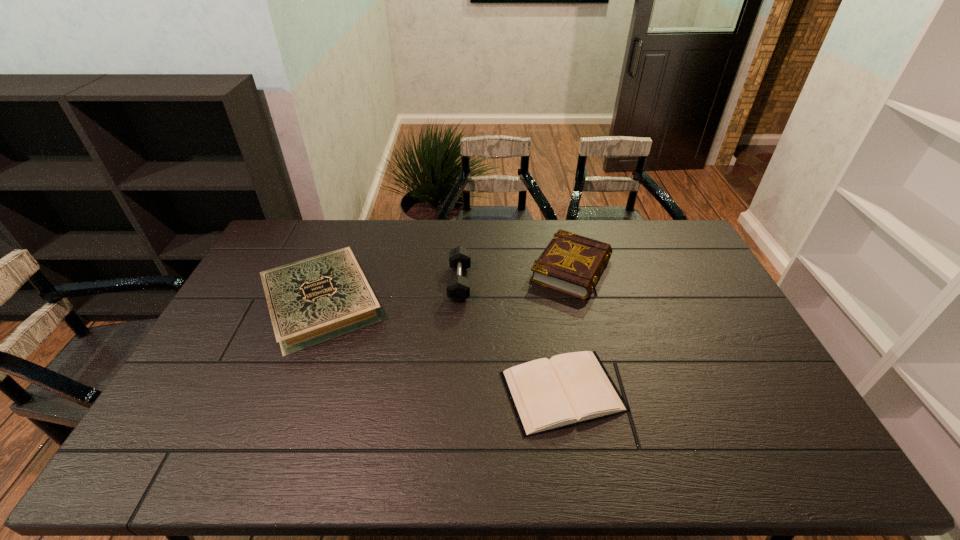
Find the location of `dumbbell`. dumbbell is located at coordinates pyautogui.click(x=458, y=287).

The width and height of the screenshot is (960, 540). I want to click on the third object from right to left, so click(458, 287).

The height and width of the screenshot is (540, 960). I want to click on the leftmost hardback book, so click(310, 301).

You are a GUI agent. You are given a task and a screenshot of the screen. Output one action in this format:
    pyautogui.click(x=<x>, y=<y>)
    Task: Click on the shortest hardback book
    Image resolution: width=960 pixels, height=540 pixels.
    Given the screenshot: What is the action you would take?
    pyautogui.click(x=546, y=394)

Where is `free location located on the left of the dumbbell`? free location located on the left of the dumbbell is located at coordinates click(391, 282).

The height and width of the screenshot is (540, 960). I want to click on blank space located 0.070m on the back of the leftmost hardback book, so click(343, 248).

Locate an element on the screen. Image resolution: width=960 pixels, height=540 pixels. vacant point located 0.090m on the right of the shortest object is located at coordinates (658, 391).

Where is `object present at the far edge`? object present at the far edge is located at coordinates (570, 263).

Identify the location of object that is at the near edge. The image size is (960, 540). (546, 394).

Image resolution: width=960 pixels, height=540 pixels. I want to click on object situated at the left edge, so click(310, 301).